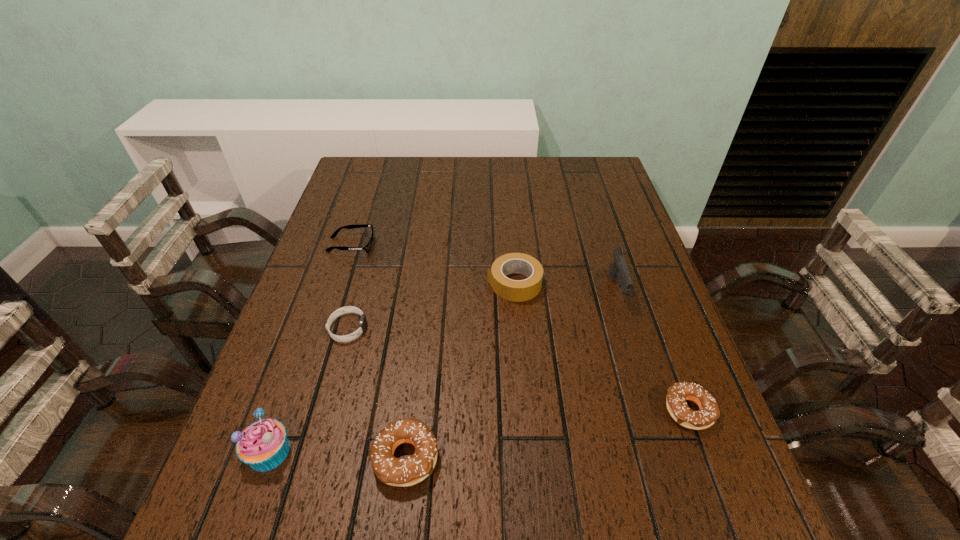
Where is `vacant region located on the left of the right doughnut`? The height and width of the screenshot is (540, 960). vacant region located on the left of the right doughnut is located at coordinates (629, 410).

You are a GUI agent. You are given a task and a screenshot of the screen. Output one action in this format:
    pyautogui.click(x=<x>, y=<y>)
    Task: Click on the vacant area situated 0.160m on the front-facing side of the farthest object
    
    Given the screenshot: What is the action you would take?
    pyautogui.click(x=431, y=245)

At what (x,y) coordinates should I click in order to perform the action: click on free space located at the edge of the fifth object from left to right. Please return your answer as a coordinate pair (x, y). The image size is (960, 540). Looking at the image, I should click on (351, 284).

Find the location of `free space located 0.110m at the edge of the fifth object from left to right`. free space located 0.110m at the edge of the fifth object from left to right is located at coordinates (444, 284).

You are a GUI agent. You are given a task and a screenshot of the screen. Output one action in this format:
    pyautogui.click(x=<x>, y=<y>)
    Task: Click on the vacant space situated 0.140m at the edge of the fifth object from left to right
    This screenshot has height=540, width=960.
    Given the screenshot: What is the action you would take?
    pyautogui.click(x=433, y=284)

In order to click on vacant space located 0.090m on the outer surface of the wristband in this screenshot , I will do `click(405, 328)`.

Find the location of a particular element. The image size is (960, 540). free space located 0.160m at the barrel of the pistol is located at coordinates (640, 367).

Locate an element on the screen. The image size is (960, 540). vacant space located on the right of the muffin is located at coordinates (438, 451).

Find the location of a particular element. Image resolution: width=960 pixels, height=540 pixels. muffin that is at the near edge is located at coordinates (263, 445).

Identify the location of sunglasses positioned at the left edge. (367, 248).